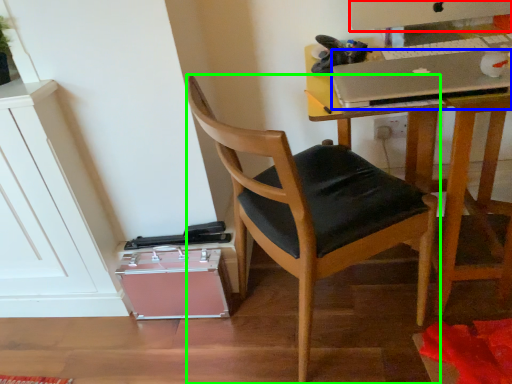
Question: Which object is positioned farthest from computer monitor (highlighted by a red box)? Select from laptop (highlighted by a blue box) and chair (highlighted by a green box).

Choices:
 (A) laptop
 (B) chair

Answer: (B)